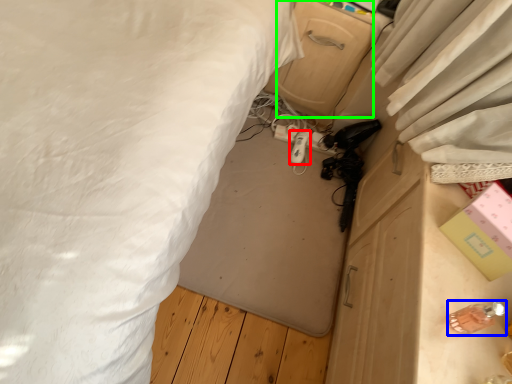
Question: Which object is positioned closest to equipment (highlighted by a red box)? Select from equipment (highlighted by a blue box) and drawer (highlighted by a green box).

Choices:
 (A) equipment
 (B) drawer

Answer: (B)